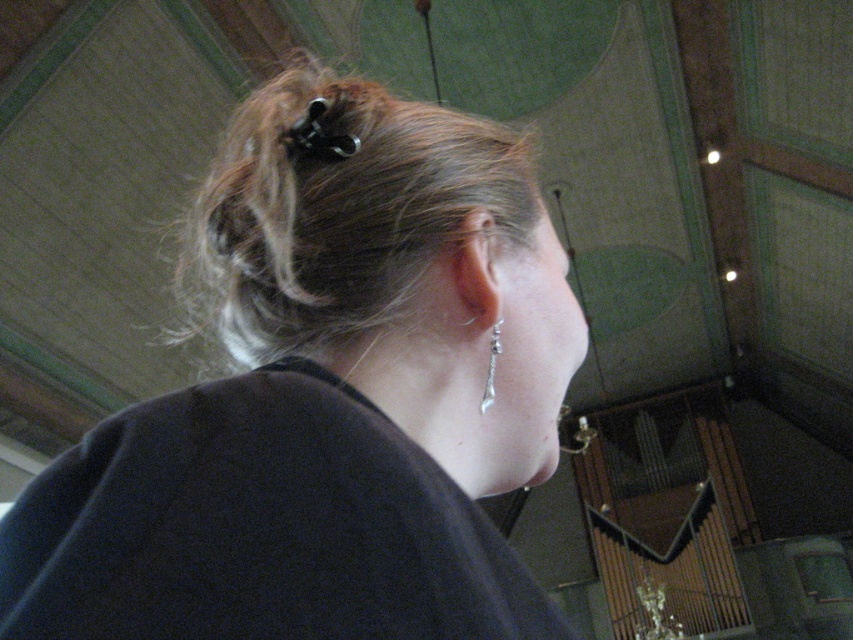
Question: Which object is the farthest from the blonde hair at upper center?

Choices:
 (A) silver metallic earring at ear
 (B) matte black hair at center

Answer: (A)

Question: Is matte black hair at center wider than blonde hair at upper center?

Choices:
 (A) yes
 (B) no

Answer: (B)

Question: Which point is farther to the camera?

Choices:
 (A) matte black hair at center
 (B) blonde hair at upper center
 (C) silver metallic earring at ear

Answer: (B)

Question: Which object is the farthest from the silver metallic earring at ear?

Choices:
 (A) blonde hair at upper center
 (B) matte black hair at center

Answer: (A)

Question: Can you confirm if matte black hair at center is bigger than silver metallic earring at ear?

Choices:
 (A) no
 (B) yes

Answer: (B)

Question: Does blonde hair at upper center have a smaller size compared to silver metallic earring at ear?

Choices:
 (A) no
 (B) yes

Answer: (A)